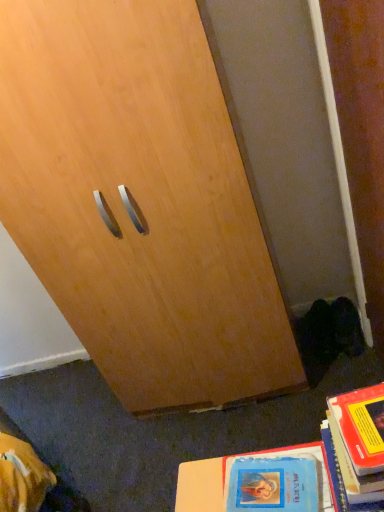
Image resolution: width=384 pixels, height=512 pixels. Describe the element at coordinates (359, 441) in the screenshot. I see `hardcover book at lower right, the 1th book positioned from the right` at that location.

Where is `hardcover book at lower right, which is the 2th book from left to right`? The width and height of the screenshot is (384, 512). hardcover book at lower right, which is the 2th book from left to right is located at coordinates (359, 441).

Image resolution: width=384 pixels, height=512 pixels. Describe the element at coordinates (229, 475) in the screenshot. I see `blue matte book at lower right, the first book positioned from the left` at that location.

The width and height of the screenshot is (384, 512). Identify the location of blue matte book at lower right, the first book positioned from the left. (229, 475).

In order to face blue matte book at lower right, which is the second book from right to left, should I rotate leftwards or rightwards?

Rotate your view right by about 11.050°.

What are the coordinates of `hardcover book at lower right, the 1th book positioned from the right` in the screenshot? It's located at (359, 441).

Between blue matte book at lower right, which is the second book from right to left, and hardcover book at lower right, the 1th book positioned from the right, which one appears on the right side from the viewer's perspective?

hardcover book at lower right, the 1th book positioned from the right.

Is blue matte book at lower right, which is the second book from right to left, further to camera compared to hardcover book at lower right, which is the 2th book from left to right?

Yes, it is.

Considering the positions of points (331, 500) and (379, 447), is point (331, 500) farther from camera compared to point (379, 447)?

Yes, it is.

From the image's perspective, is blue matte book at lower right, the first book positioned from the left, on top of hardcover book at lower right, the 1th book positioned from the right?

No, from the image's perspective, blue matte book at lower right, the first book positioned from the left, is not on top of hardcover book at lower right, the 1th book positioned from the right.

From a real-world perspective, between blue matte book at lower right, which is the second book from right to left, and hardcover book at lower right, the 1th book positioned from the right, who is vertically lower?

In real-world perspective, blue matte book at lower right, which is the second book from right to left, is lower.

Which of these two, blue matte book at lower right, which is the second book from right to left, or hardcover book at lower right, the 1th book positioned from the right, is thinner?

Thinner between the two is blue matte book at lower right, which is the second book from right to left.

Is blue matte book at lower right, the first book positioned from the left, taller than hardcover book at lower right, which is the 2th book from left to right?

Incorrect, the height of blue matte book at lower right, the first book positioned from the left, is not larger of that of hardcover book at lower right, which is the 2th book from left to right.

Considering the relative sizes of blue matte book at lower right, the first book positioned from the left, and hardcover book at lower right, which is the 2th book from left to right, in the image provided, is blue matte book at lower right, the first book positioned from the left, bigger than hardcover book at lower right, which is the 2th book from left to right,?

No, blue matte book at lower right, the first book positioned from the left, is not bigger than hardcover book at lower right, which is the 2th book from left to right.

Is blue matte book at lower right, the first book positioned from the left, situated inside hardcover book at lower right, which is the 2th book from left to right, or outside?

The correct answer is: outside.

Is blue matte book at lower right, the first book positioned from the left, directly adjacent to hardcover book at lower right, the 1th book positioned from the right?

No.

Could you tell me if blue matte book at lower right, which is the second book from right to left, is facing hardcover book at lower right, which is the 2th book from left to right?

No.

How many degrees apart are the facing directions of blue matte book at lower right, the first book positioned from the left, and hardcover book at lower right, the 1th book positioned from the right?

The angle between the facing direction of blue matte book at lower right, the first book positioned from the left, and the facing direction of hardcover book at lower right, the 1th book positioned from the right, is 2.83 degrees.

Could you measure the distance between blue matte book at lower right, which is the second book from right to left, and hardcover book at lower right, which is the 2th book from left to right?

The distance of blue matte book at lower right, which is the second book from right to left, from hardcover book at lower right, which is the 2th book from left to right, is 5.56 inches.

The width and height of the screenshot is (384, 512). I want to click on book behind the hardcover book at lower right, the 1th book positioned from the right, so click(229, 475).

Which is more to the left, hardcover book at lower right, which is the 2th book from left to right, or blue matte book at lower right, the first book positioned from the left?

blue matte book at lower right, the first book positioned from the left, is more to the left.

Does hardcover book at lower right, which is the 2th book from left to right, come in front of blue matte book at lower right, which is the second book from right to left?

Yes, it is.

Between point (378, 478) and point (263, 456), which one is positioned behind?

The point (263, 456) is farther.

Consider the image. From the image's perspective, is hardcover book at lower right, which is the 2th book from left to right, located beneath blue matte book at lower right, the first book positioned from the left?

No, from the image's perspective, hardcover book at lower right, which is the 2th book from left to right, is not below blue matte book at lower right, the first book positioned from the left.

From a real-world perspective, is hardcover book at lower right, the 1th book positioned from the right, above or below blue matte book at lower right, which is the second book from right to left?

Clearly, from a real-world perspective, hardcover book at lower right, the 1th book positioned from the right, is above blue matte book at lower right, which is the second book from right to left.

Is hardcover book at lower right, which is the 2th book from left to right, wider or thinner than blue matte book at lower right, which is the second book from right to left?

Considering their sizes, hardcover book at lower right, which is the 2th book from left to right, looks broader than blue matte book at lower right, which is the second book from right to left.

In terms of height, does hardcover book at lower right, which is the 2th book from left to right, look taller or shorter compared to blue matte book at lower right, which is the second book from right to left?

Clearly, hardcover book at lower right, which is the 2th book from left to right, is taller compared to blue matte book at lower right, which is the second book from right to left.

Is hardcover book at lower right, which is the 2th book from left to right, smaller than blue matte book at lower right, which is the second book from right to left?

No.

From the picture: Is hardcover book at lower right, which is the 2th book from left to right, not within blue matte book at lower right, which is the second book from right to left?

Yes, hardcover book at lower right, which is the 2th book from left to right, is outside of blue matte book at lower right, which is the second book from right to left.

Is hardcover book at lower right, which is the 2th book from left to right, far away from blue matte book at lower right, the first book positioned from the left?

No.

Is hardcover book at lower right, the 1th book positioned from the right, facing away from blue matte book at lower right, the first book positioned from the left?

hardcover book at lower right, the 1th book positioned from the right, is not turned away from blue matte book at lower right, the first book positioned from the left.

Measure the distance between hardcover book at lower right, which is the 2th book from left to right, and blue matte book at lower right, the first book positioned from the left.

hardcover book at lower right, which is the 2th book from left to right, is 5.56 inches away from blue matte book at lower right, the first book positioned from the left.

The image size is (384, 512). What are the coordinates of `book above the blue matte book at lower right, the first book positioned from the left (from the image's perspective)` in the screenshot? It's located at (359, 441).

At what (x,y) coordinates should I click in order to perform the action: click on book below the hardcover book at lower right, the 1th book positioned from the right (from a real-world perspective). Please return your answer as a coordinate pair (x, y). This screenshot has height=512, width=384. Looking at the image, I should click on (229, 475).

Image resolution: width=384 pixels, height=512 pixels. Find the location of `book located above the blue matte book at lower right, the first book positioned from the left (from the image's perspective)`. book located above the blue matte book at lower right, the first book positioned from the left (from the image's perspective) is located at coordinates (359, 441).